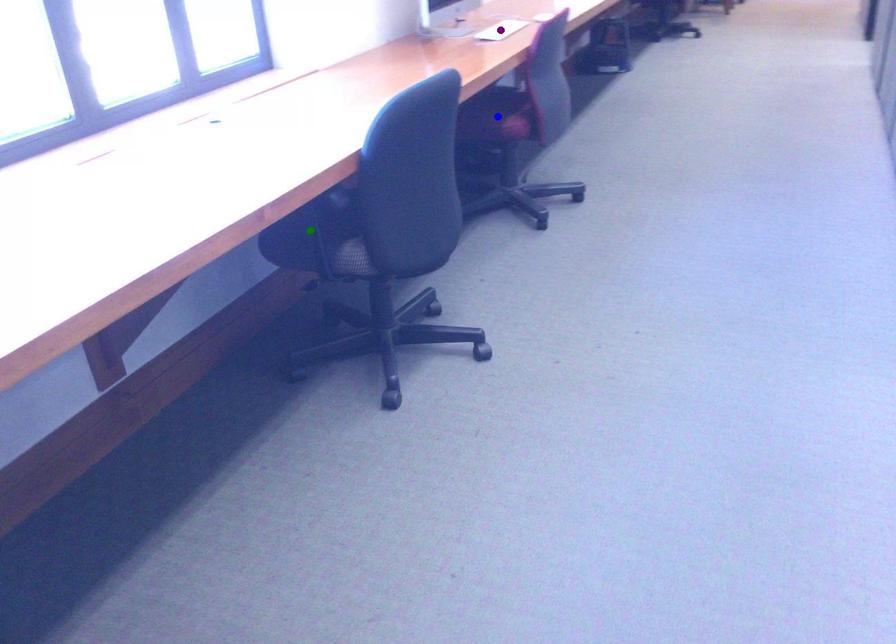
Order these from nearest to farthest:
blue point | green point | purple point

green point
blue point
purple point